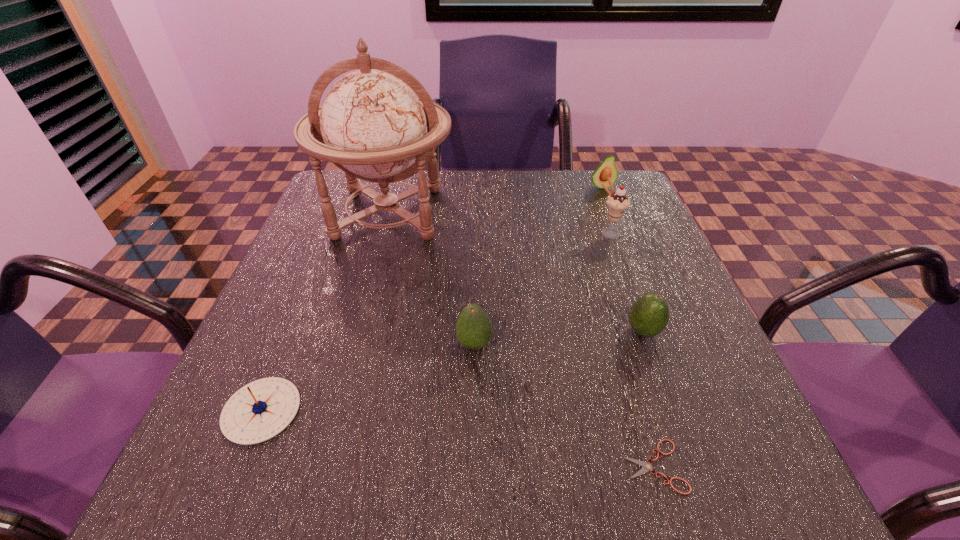
What are the coordinates of `object that is at the far left corner` in the screenshot? It's located at (371, 125).

The image size is (960, 540). I want to click on object present at the near left corner, so click(x=260, y=410).

Where is `object present at the far right corner`? Image resolution: width=960 pixels, height=540 pixels. object present at the far right corner is located at coordinates (607, 168).

The image size is (960, 540). What are the coordinates of `object that is at the near right corner` in the screenshot? It's located at (647, 467).

Find the location of a particular element. The height and width of the screenshot is (540, 960). vacant space at the far edge is located at coordinates (549, 196).

In the image, there is a desktop. At what (x,y) coordinates should I click in order to perform the action: click on vacant space at the near edge. Please return your answer as a coordinate pair (x, y). The width and height of the screenshot is (960, 540). Looking at the image, I should click on (310, 488).

Where is `free spot at the left edge of the desktop`? free spot at the left edge of the desktop is located at coordinates (348, 261).

Where is `free space at the right edge of the desktop`? This screenshot has height=540, width=960. free space at the right edge of the desktop is located at coordinates pyautogui.click(x=723, y=361).

Identify the location of vacant space at the far left corner of the desktop. The width and height of the screenshot is (960, 540). (337, 198).

Where is `free location at the near left corner of the desktop`? The width and height of the screenshot is (960, 540). free location at the near left corner of the desktop is located at coordinates pyautogui.click(x=206, y=444).